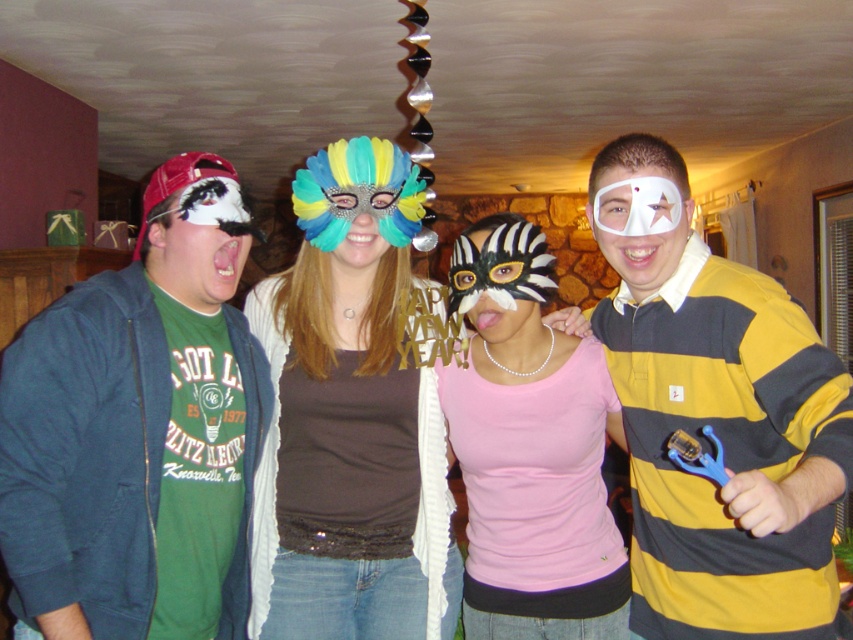
You are standing in the living room and want to place a small decoration between the two points, point 1 at point (277,356) and point 2 at point (347,212). Which point should you move the decoration closer to so that it appears larger in the image?

To make the decoration appear larger in the image, you should move it closer to point 1 at point (277,356) because it is closer to the camera than point 2 at point (347,212). Objects closer to the camera appear larger in the image.

You are a photographer trying to capture a group photo of the yellow and gray striped polo shirt at right and the pink matte shirt at center. The camera you are using has a minimum focus distance of 8 inches. Will you be able to focus on both subjects clearly?

The yellow and gray striped polo shirt at right and the pink matte shirt at center are 7.88 inches apart from each other. Since the camera requires a minimum focus distance of 8 inches, the subjects are too close to be focused on simultaneously. You might need to move them slightly farther apart or adjust your position to ensure both are in focus.